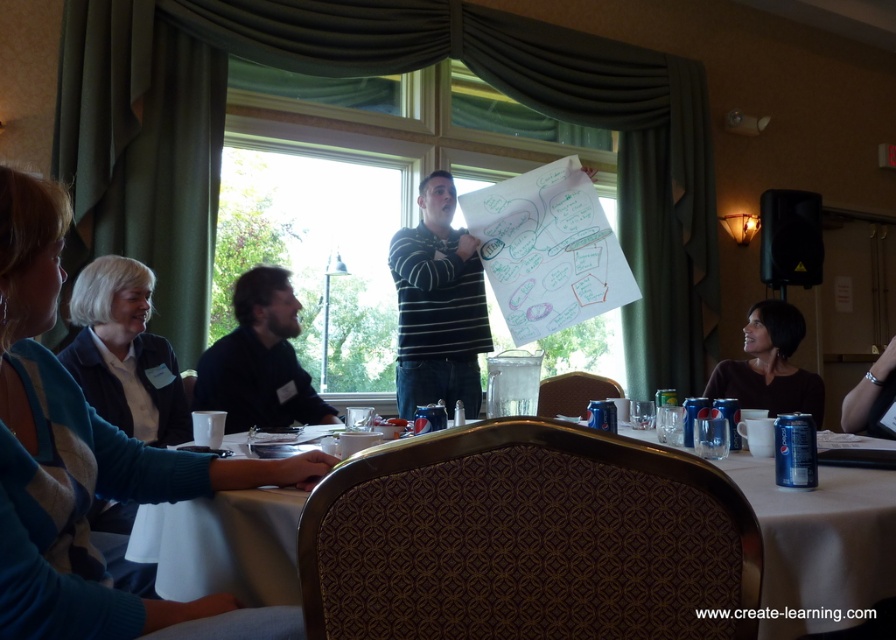
You are a person who is 1.7 meters tall and wants to reach the striped cotton shirt at center from the white fabric table at lower center. Can you do it without moving the table?

The distance between the white fabric table at lower center and the striped cotton shirt at center is 1.61 meters. Since you are 1.7 meters tall, you can easily reach the striped cotton shirt at center from the white fabric table at lower center without moving the table.

You are standing at the center of the room and want to hand a document to the person wearing the striped sweater at left. Based on their position relative to you, in which general direction should you walk to reach them?

Since the striped sweater at left is located at point (85,460), you should walk to the left to reach the person wearing the striped sweater at left.